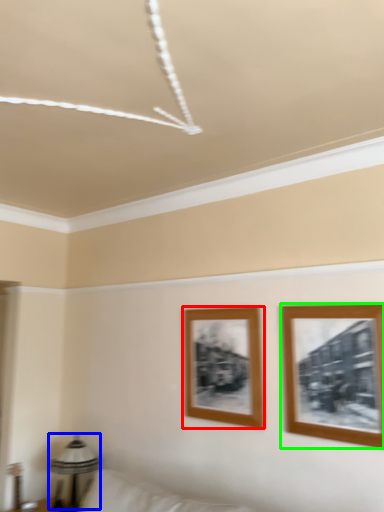
Question: Considering the real-world distances, which object is farthest from picture frame (highlighted by a red box)? table lamp (highlighted by a blue box) or picture frame (highlighted by a green box)?

Choices:
 (A) table lamp
 (B) picture frame

Answer: (A)